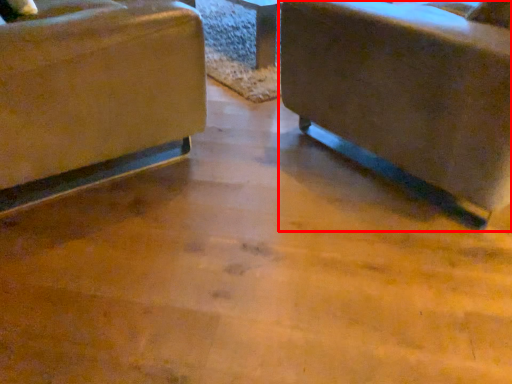
Question: In this image, where is chair (annotated by the red box) located relative to chair?

Choices:
 (A) right
 (B) left

Answer: (A)